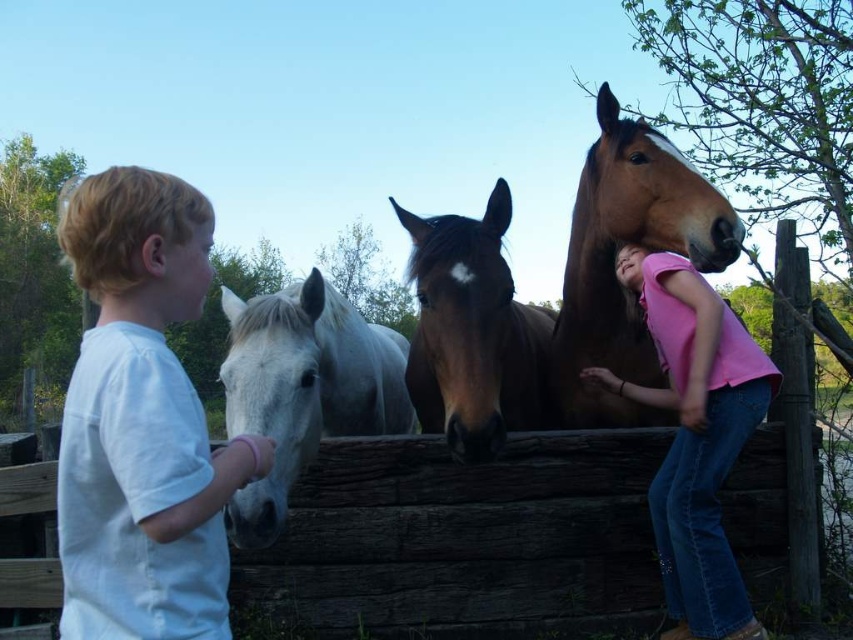
Consider the image. You are a photographer trying to capture a photo of both the brown glossy horse at upper right and the brown glossy horse at center. Based on their positions, which horse would appear higher in the photo?

The brown glossy horse at upper right would appear higher in the photo because it is positioned above the brown glossy horse at center.

From the picture: You are a photographer trying to capture a photo of both the brown glossy horse at upper right and the brown glossy horse at center. Since you want both horses to be in the frame, which horse should you focus on to ensure both are visible?

The brown glossy horse at upper right is taller than the brown glossy horse at center. To include both in the frame, focus on the brown glossy horse at upper right as the primary subject, ensuring the shorter horse at center remains within the camera view.

Looking at this image, you are a photographer trying to capture a clear shot of the brown glossy horse at center and the pink cotton shirt at upper right. Based on their positions, will the horse block the view of the shirt?

The pink cotton shirt at upper right is positioned under the brown glossy horse at center, so the horse will block the view of the shirt.